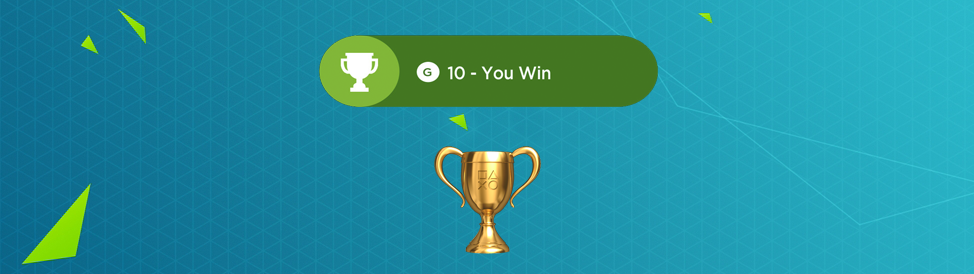
Where is `trophy`? The width and height of the screenshot is (974, 274). trophy is located at coordinates (488, 201), (360, 64).